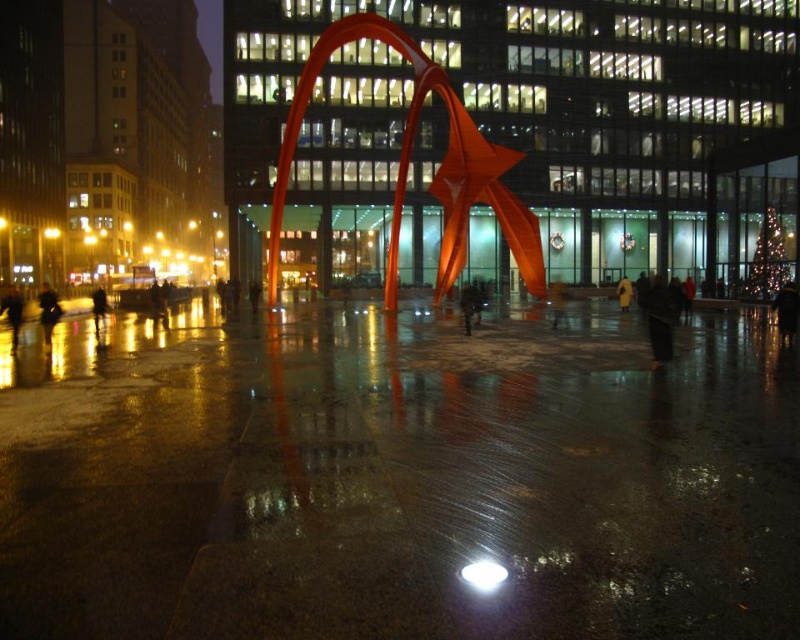
Question: In this image, where is shiny orange sculpture at center located relative to dark gray coat at lower left?

Choices:
 (A) right
 (B) left

Answer: (A)

Question: Which point is farther from the camera taking this photo?

Choices:
 (A) (100, 307)
 (B) (504, 157)

Answer: (B)

Question: Considering the relative positions of shiny orange sculpture at center and dark gray coat at lower left in the image provided, where is shiny orange sculpture at center located with respect to dark gray coat at lower left?

Choices:
 (A) below
 (B) above

Answer: (B)

Question: Is shiny orange sculpture at center smaller than dark gray coat at lower left?

Choices:
 (A) no
 (B) yes

Answer: (A)

Question: Which object appears farthest from the camera in this image?

Choices:
 (A) shiny orange sculpture at center
 (B) dark gray coat at lower left

Answer: (A)